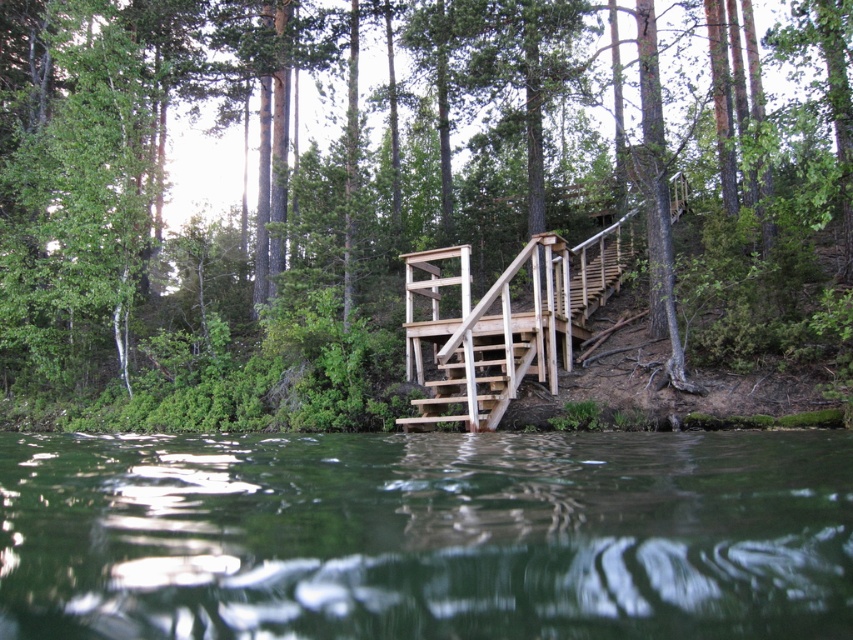
You are standing on the wooden staircase leading into the water in the image. There is a point marked at coordinates (426,536). What is located at that point?

The point at coordinates (426,536) is where the green liquid water at center is located.

You are standing on the platform at the top of the wooden staircase and want to look towards the green liquid water at center. Which direction should you turn to see the green wood tree at upper center?

The green wood tree at upper center is positioned on the left side of green liquid water at center, so to see it, you should turn to your left while facing the green liquid water at center.